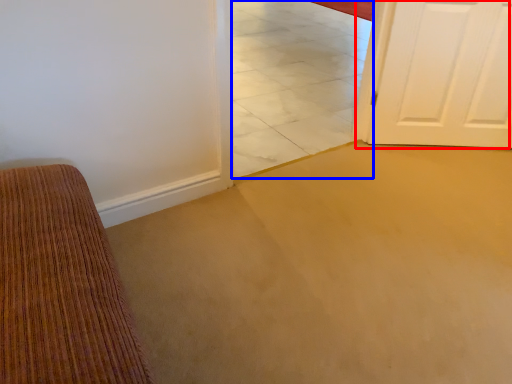
Question: Which object is closer to the camera taking this photo, door (highlighted by a red box) or tile (highlighted by a blue box)?

Choices:
 (A) door
 (B) tile

Answer: (B)